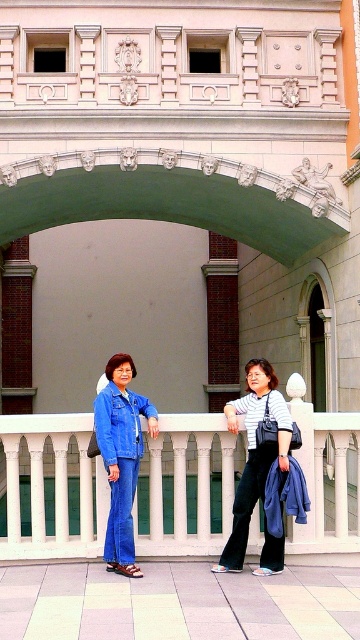
Based on the photo, who is more forward, (159, 554) or (245, 516)?

Point (245, 516) is more forward.

Does point (191, 483) come in front of point (259, 458)?

No, (191, 483) is behind (259, 458).

This screenshot has width=360, height=640. What are the coordinates of `white marble balustrade at center` in the screenshot? It's located at (51, 488).

At what (x,y) coordinates should I click in order to perform the action: click on white marble balustrade at center. Please return your answer as a coordinate pair (x, y). The width and height of the screenshot is (360, 640). Looking at the image, I should click on (51, 488).

At what (x,y) coordinates should I click in order to perform the action: click on denim jacket at center. Please return your answer as a coordinate pair (x, y). The height and width of the screenshot is (640, 360). Looking at the image, I should click on (122, 456).

Is point (128, 376) closer to camera compared to point (228, 403)?

Yes.

Where is `denim jacket at center`? This screenshot has width=360, height=640. denim jacket at center is located at coordinates [122, 456].

Which is behind, point (209, 497) or point (114, 449)?

Positioned behind is point (209, 497).

Locate an element on the screen. white marble balustrade at center is located at coordinates (51, 488).